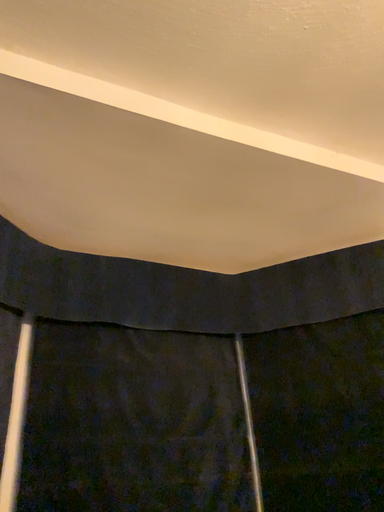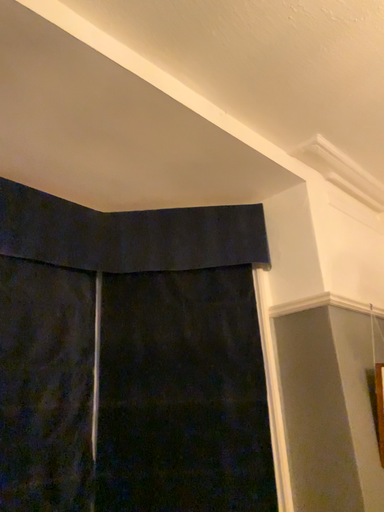
Question: Which way did the camera rotate in the video?

Choices:
 (A) rotated upward
 (B) rotated downward

Answer: (B)